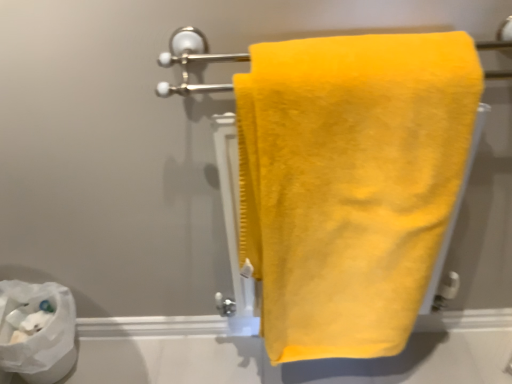
Question: Considering the relative sizes of white paper at lower left and satin yellow towel at center in the image provided, is white paper at lower left shorter than satin yellow towel at center?

Choices:
 (A) no
 (B) yes

Answer: (A)

Question: Does white paper at lower left have a smaller size compared to satin yellow towel at center?

Choices:
 (A) yes
 (B) no

Answer: (B)

Question: Is white paper at lower left bigger than satin yellow towel at center?

Choices:
 (A) no
 (B) yes

Answer: (B)

Question: From a real-world perspective, is white paper at lower left physically above satin yellow towel at center?

Choices:
 (A) yes
 (B) no

Answer: (B)

Question: Is the surface of white paper at lower left in direct contact with satin yellow towel at center?

Choices:
 (A) yes
 (B) no

Answer: (B)

Question: From a real-world perspective, is white paper at lower left physically located above or below yellow fluffy towel at center?

Choices:
 (A) below
 (B) above

Answer: (A)

Question: Considering the relative positions of white paper at lower left and yellow fluffy towel at center in the image provided, is white paper at lower left to the left or to the right of yellow fluffy towel at center?

Choices:
 (A) left
 (B) right

Answer: (A)

Question: Considering the positions of white paper at lower left and yellow fluffy towel at center in the image, is white paper at lower left bigger or smaller than yellow fluffy towel at center?

Choices:
 (A) big
 (B) small

Answer: (B)

Question: Is white paper at lower left in front of or behind yellow fluffy towel at center in the image?

Choices:
 (A) front
 (B) behind

Answer: (B)

Question: Based on their sizes in the image, would you say yellow fluffy towel at center is bigger or smaller than satin yellow towel at center?

Choices:
 (A) small
 (B) big

Answer: (B)

Question: Does point (243, 248) appear closer or farther from the camera than point (168, 87)?

Choices:
 (A) closer
 (B) farther

Answer: (B)

Question: From the image's perspective, relative to satin yellow towel at center, is yellow fluffy towel at center above or below?

Choices:
 (A) below
 (B) above

Answer: (A)

Question: Would you say yellow fluffy towel at center is to the left or to the right of satin yellow towel at center in the picture?

Choices:
 (A) left
 (B) right

Answer: (B)

Question: From the image's perspective, is satin yellow towel at center located above or below yellow fluffy towel at center?

Choices:
 (A) below
 (B) above

Answer: (B)

Question: Considering the positions of satin yellow towel at center and yellow fluffy towel at center in the image, is satin yellow towel at center wider or thinner than yellow fluffy towel at center?

Choices:
 (A) thin
 (B) wide

Answer: (A)